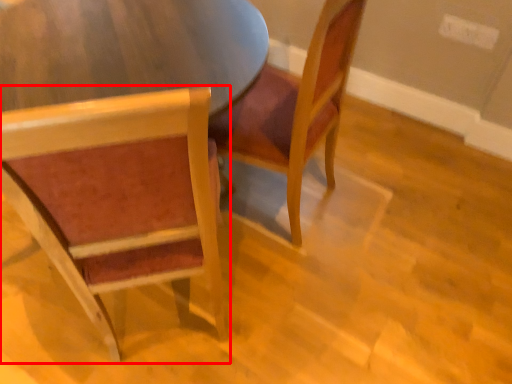
Question: Considering the relative positions of chair (annotated by the red box) and chair in the image provided, where is chair (annotated by the red box) located with respect to the staircase?

Choices:
 (A) left
 (B) right

Answer: (A)